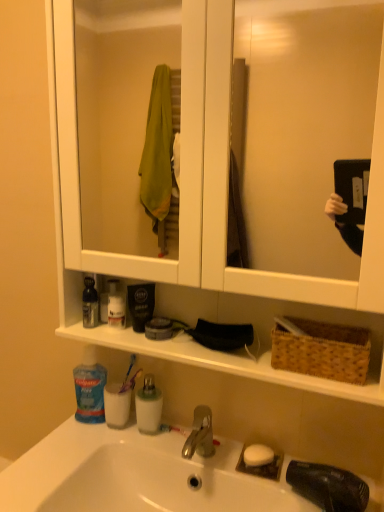
You are a GUI agent. You are given a task and a screenshot of the screen. Output one action in this format:
    pyautogui.click(x=<x>, y=<y>)
    Task: Click on the vacant space to the left of clear plastic container at center
    The height and width of the screenshot is (512, 384).
    Given the screenshot: What is the action you would take?
    pyautogui.click(x=81, y=449)